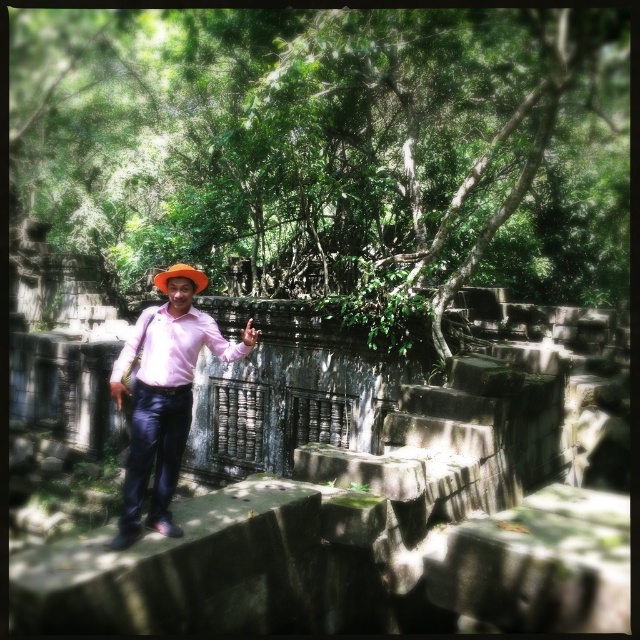
You are a photographer trying to capture the man in the image. Since the pink matte shirt at center and the orange felt hat at center are both important, which one should you focus on to ensure both are visible in the photo?

The pink matte shirt at center is in front of the orange felt hat at center, so focusing on the pink matte shirt at center will ensure both are visible.

You are a fashion designer observing the man in the image. You need to determine which item of his clothing takes up more visual space in the scene. Based on the pink matte shirt at center and the orange felt hat at center, which one is larger?

The pink matte shirt at center is bigger than the orange felt hat at center, so the pink matte shirt at center takes up more visual space in the scene.

You are standing on the stone steps where the man is and want to move towards the wall behind him. Which point, point (208, 326) or point (182, 269), is closer to you as you face the wall?

Point (208, 326) is closer to you because it is further to the viewer than point (182, 269). Since you are facing the wall, the point closer to you would be the one that is nearer in the scene, which is the one further to the viewer.